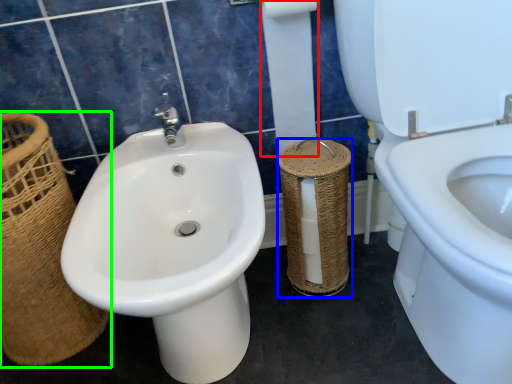
Question: Which is farther away from toilet paper (highlighted by a red box)? basket container (highlighted by a blue box) or basket (highlighted by a green box)?

Choices:
 (A) basket container
 (B) basket

Answer: (B)